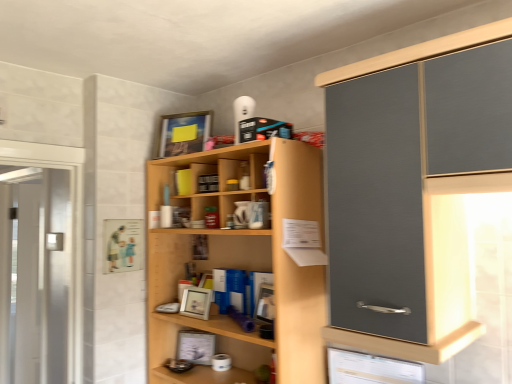
Question: From a real-world perspective, is matte wooden picture frame at upper center, placed as the third picture frame when sorted from bottom to top, positioned over white matte picture frame at center, the 2th picture frame when ordered from bottom to top, based on gravity?

Choices:
 (A) no
 (B) yes

Answer: (B)

Question: Is matte wooden picture frame at upper center, placed as the third picture frame when sorted from bottom to top, to the left of white matte picture frame at center, the 2th picture frame when ordered from bottom to top, from the viewer's perspective?

Choices:
 (A) no
 (B) yes

Answer: (B)

Question: Is matte wooden picture frame at upper center, which is the first picture frame in top-to-bottom order, next to white matte picture frame at center, which ranks as the 2th picture frame in top-to-bottom order, and touching it?

Choices:
 (A) yes
 (B) no

Answer: (B)

Question: From a real-world perspective, is matte wooden picture frame at upper center, placed as the third picture frame when sorted from bottom to top, physically below white matte picture frame at center, the 2th picture frame when ordered from bottom to top?

Choices:
 (A) yes
 (B) no

Answer: (B)

Question: Does matte wooden picture frame at upper center, placed as the third picture frame when sorted from bottom to top, have a greater height compared to white matte picture frame at center, which ranks as the 2th picture frame in top-to-bottom order?

Choices:
 (A) no
 (B) yes

Answer: (B)

Question: Considering the positions of matte wooden picture frame at upper center, which is the first picture frame in top-to-bottom order, and white matte picture frame at center, which ranks as the 2th picture frame in top-to-bottom order, in the image, is matte wooden picture frame at upper center, which is the first picture frame in top-to-bottom order, wider or thinner than white matte picture frame at center, which ranks as the 2th picture frame in top-to-bottom order,?

Choices:
 (A) thin
 (B) wide

Answer: (A)

Question: From a real-world perspective, is matte wooden picture frame at upper center, placed as the third picture frame when sorted from bottom to top, above or below white matte picture frame at center, which ranks as the 2th picture frame in top-to-bottom order?

Choices:
 (A) above
 (B) below

Answer: (A)

Question: Is matte wooden picture frame at upper center, which is the first picture frame in top-to-bottom order, taller or shorter than white matte picture frame at center, the 2th picture frame when ordered from bottom to top?

Choices:
 (A) short
 (B) tall

Answer: (B)

Question: From the image's perspective, relative to white matte picture frame at center, which ranks as the 2th picture frame in top-to-bottom order, is matte wooden picture frame at upper center, placed as the third picture frame when sorted from bottom to top, above or below?

Choices:
 (A) below
 (B) above

Answer: (B)

Question: Based on their sizes in the image, would you say light wood cupboard at center is bigger or smaller than transparent glass screen door at left?

Choices:
 (A) small
 (B) big

Answer: (B)

Question: Choose the correct answer: Is light wood cupboard at center inside transparent glass screen door at left or outside it?

Choices:
 (A) outside
 (B) inside

Answer: (A)

Question: Is light wood cupboard at center wider or thinner than transparent glass screen door at left?

Choices:
 (A) wide
 (B) thin

Answer: (A)

Question: Relative to transparent glass screen door at left, is light wood cupboard at center in front or behind?

Choices:
 (A) front
 (B) behind

Answer: (A)

Question: From the image's perspective, relative to transparent glass screen door at left, is metallic silver picture frame at lower center, which appears as the first picture frame when ordered from the bottom, above or below?

Choices:
 (A) below
 (B) above

Answer: (A)

Question: In terms of size, does metallic silver picture frame at lower center, the third picture frame positioned from the top, appear bigger or smaller than transparent glass screen door at left?

Choices:
 (A) big
 (B) small

Answer: (B)